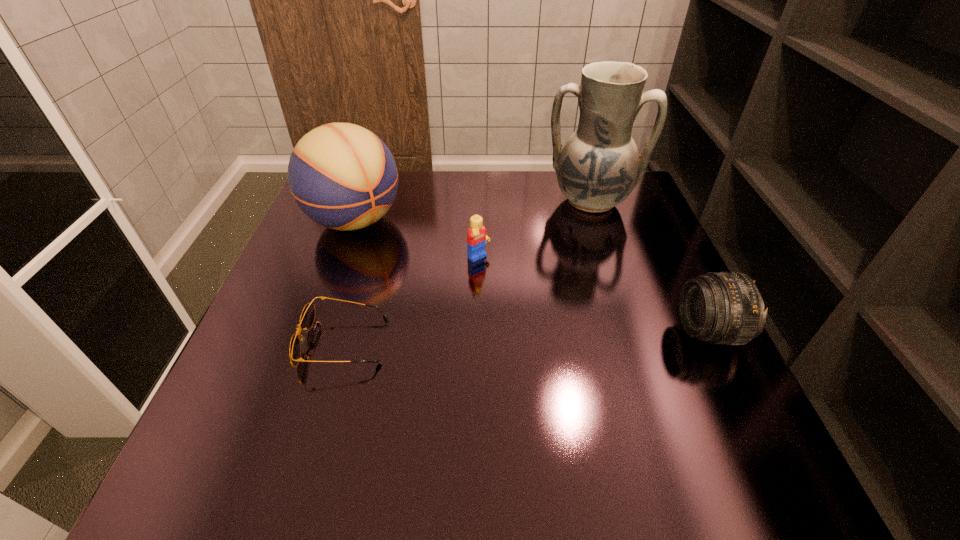
Locate an element on the screen. blank region between the basketball and the shortest object is located at coordinates coord(349,282).

This screenshot has width=960, height=540. Find the location of `free point between the telephoto lens and the fourth tallest object`. free point between the telephoto lens and the fourth tallest object is located at coordinates (593, 295).

The width and height of the screenshot is (960, 540). In order to click on free spot between the sunglasses and the fourth shortest object in this screenshot , I will do `click(349, 282)`.

Locate which object ranks in proximity to the telephoto lens. Please provide its 2D coordinates. Your answer should be formatted as a tuple, i.e. [(x, y)], where the tuple contains the x and y coordinates of a point satisfying the conditions above.

[(598, 167)]

You are a GUI agent. You are given a task and a screenshot of the screen. Output one action in this format:
    pyautogui.click(x=<x>, y=<y>)
    Task: Click on the closest object to the tallest object
    
    Given the screenshot: What is the action you would take?
    pyautogui.click(x=477, y=236)